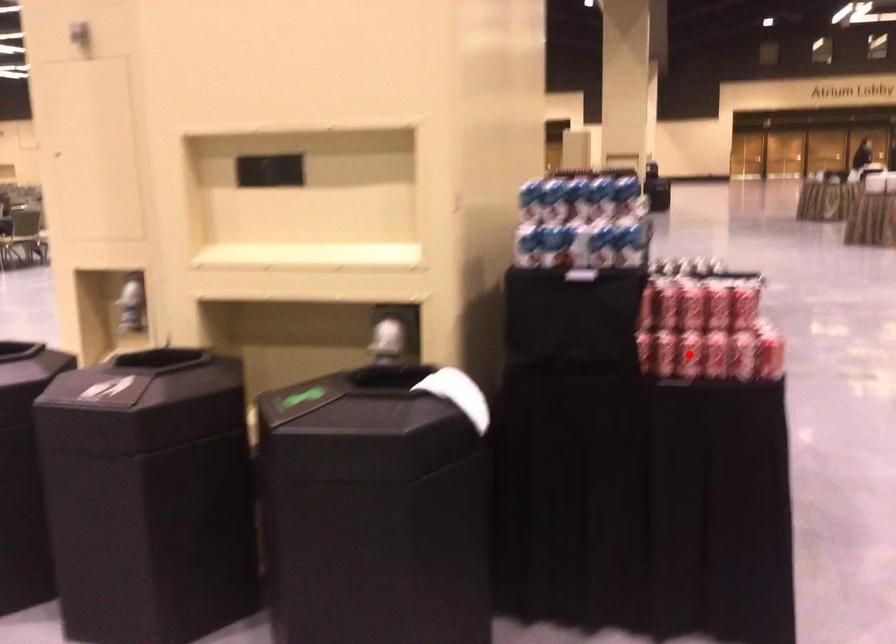
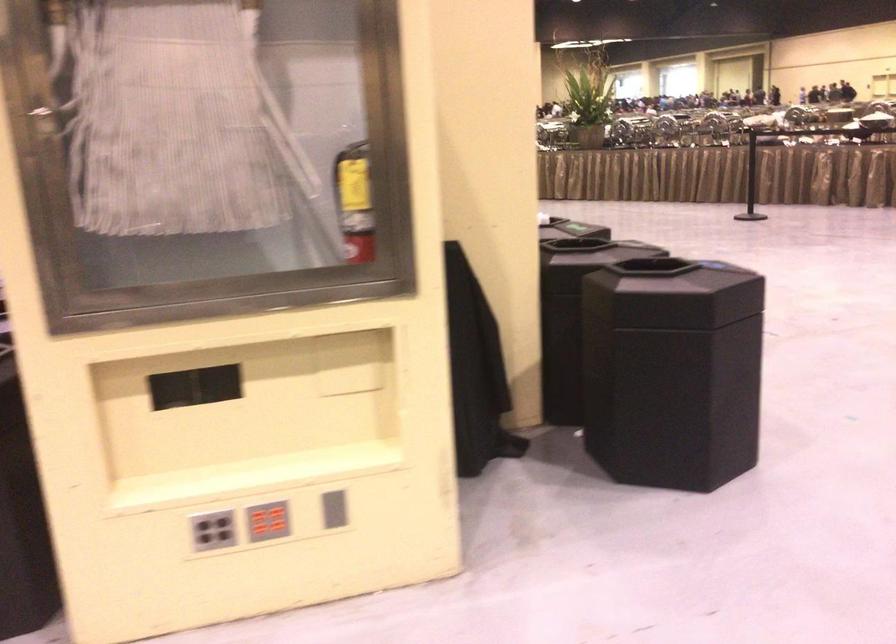
Question: I am providing you with two images of the same scene from different viewpoints. A red point is marked on the first image. At the location where the point appears in image 1, is it still visible in image 2?

Choices:
 (A) Yes
 (B) No

Answer: (B)